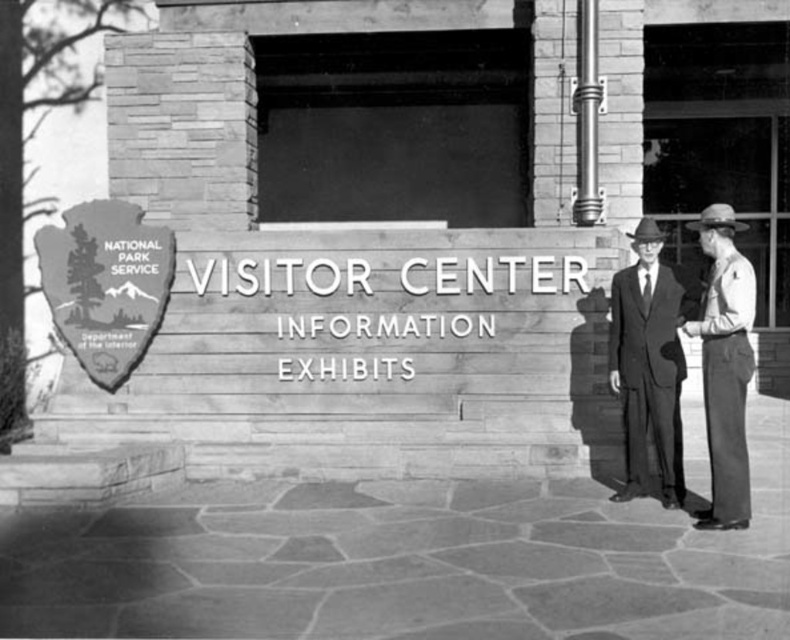
Image resolution: width=790 pixels, height=640 pixels. In order to click on wooden shield at center in this screenshot , I will do `click(104, 284)`.

Between wooden shield at center and smooth leather hat at right, which one appears on the left side from the viewer's perspective?

wooden shield at center

The height and width of the screenshot is (640, 790). Describe the element at coordinates (104, 284) in the screenshot. I see `wooden shield at center` at that location.

I want to click on wooden shield at center, so click(104, 284).